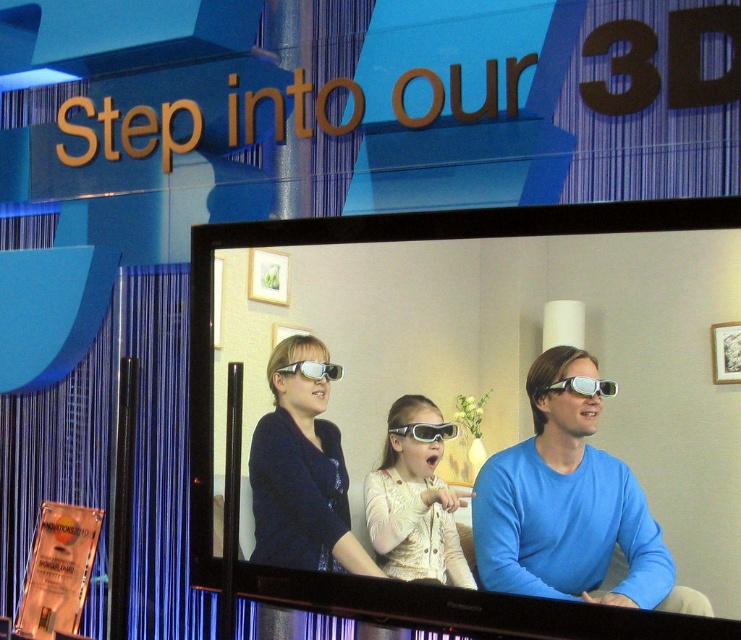
Between blue matte shirt at center and matte white glasses at center, which one appears on the left side from the viewer's perspective?

Positioned to the left is matte white glasses at center.

Who is more forward, (574,532) or (382,513)?

Point (574,532) is more forward.

This screenshot has width=741, height=640. Identify the location of blue matte shirt at center. click(568, 508).

Consider the image. Is matte gray goggles at center closer to the viewer compared to matte white goggles at center?

Yes, matte gray goggles at center is closer to the viewer.

Is matte gray goggles at center bigger than matte white goggles at center?

No, matte gray goggles at center is not bigger than matte white goggles at center.

Locate an element on the screen. The height and width of the screenshot is (640, 741). matte gray goggles at center is located at coordinates (425, 432).

In the scene shown: Between black glossy tv at center and blue matte shirt at center, which one is positioned lower?

blue matte shirt at center

Which is more to the left, black glossy tv at center or blue matte shirt at center?

Positioned to the left is black glossy tv at center.

Is point (370, 586) positioned after point (482, 528)?

Yes, point (370, 586) is farther from viewer.

The width and height of the screenshot is (741, 640). In order to click on black glossy tv at center in this screenshot , I will do `click(482, 410)`.